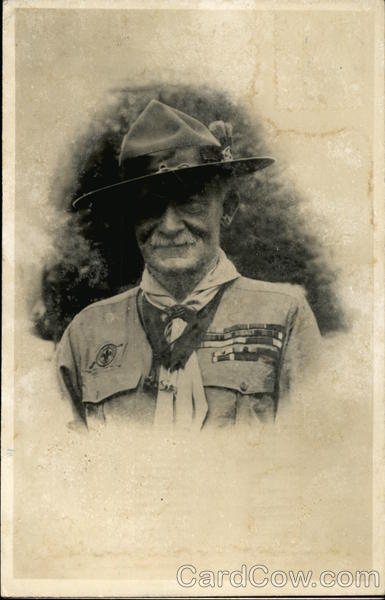
This screenshot has width=385, height=600. In order to click on old photograph in this screenshot , I will do `click(300, 63)`.